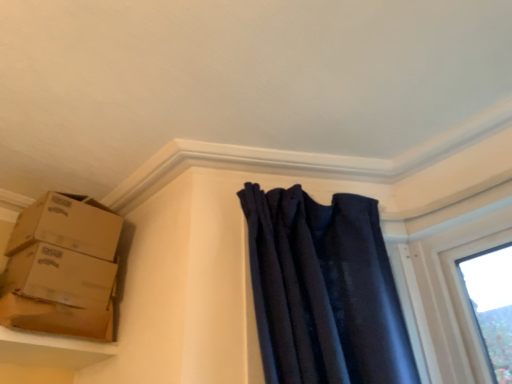
Question: From a real-world perspective, is smooth beige shelf at lower left physically above brown cardboard boxes at left, marked as the 2th box in a top-to-bottom arrangement?

Choices:
 (A) yes
 (B) no

Answer: (B)

Question: Does smooth beige shelf at lower left have a lesser height compared to brown cardboard boxes at left, marked as the 2th box in a top-to-bottom arrangement?

Choices:
 (A) no
 (B) yes

Answer: (B)

Question: Is smooth beige shelf at lower left to the left of brown cardboard boxes at left, the first box when ordered from bottom to top, from the viewer's perspective?

Choices:
 (A) yes
 (B) no

Answer: (A)

Question: Is the position of smooth beige shelf at lower left more distant than that of brown cardboard boxes at left, the first box when ordered from bottom to top?

Choices:
 (A) yes
 (B) no

Answer: (B)

Question: Are smooth beige shelf at lower left and brown cardboard boxes at left, marked as the 2th box in a top-to-bottom arrangement, beside each other?

Choices:
 (A) yes
 (B) no

Answer: (B)

Question: From the image's perspective, is brown cardboard box at left above or below brown cardboard boxes at upper left, the 2th box in the bottom-to-top sequence?

Choices:
 (A) above
 (B) below

Answer: (B)

Question: Considering the positions of brown cardboard box at left and brown cardboard boxes at upper left, the 2th box in the bottom-to-top sequence, in the image, is brown cardboard box at left taller or shorter than brown cardboard boxes at upper left, the 2th box in the bottom-to-top sequence,?

Choices:
 (A) tall
 (B) short

Answer: (B)

Question: Looking at the image, does brown cardboard box at left seem bigger or smaller compared to brown cardboard boxes at upper left, the 2th box in the bottom-to-top sequence?

Choices:
 (A) big
 (B) small

Answer: (B)

Question: Considering the relative positions of brown cardboard box at left and brown cardboard boxes at upper left, the 2th box in the bottom-to-top sequence, in the image provided, is brown cardboard box at left to the left or to the right of brown cardboard boxes at upper left, the 2th box in the bottom-to-top sequence,?

Choices:
 (A) left
 (B) right

Answer: (B)

Question: Considering the positions of brown cardboard boxes at left, marked as the 2th box in a top-to-bottom arrangement, and smooth beige shelf at lower left in the image, is brown cardboard boxes at left, marked as the 2th box in a top-to-bottom arrangement, wider or thinner than smooth beige shelf at lower left?

Choices:
 (A) wide
 (B) thin

Answer: (B)

Question: Relative to smooth beige shelf at lower left, is brown cardboard boxes at left, the first box when ordered from bottom to top, in front or behind?

Choices:
 (A) behind
 (B) front

Answer: (A)

Question: In terms of height, does brown cardboard boxes at left, marked as the 2th box in a top-to-bottom arrangement, look taller or shorter compared to smooth beige shelf at lower left?

Choices:
 (A) short
 (B) tall

Answer: (B)

Question: Is brown cardboard boxes at left, marked as the 2th box in a top-to-bottom arrangement, inside or outside of smooth beige shelf at lower left?

Choices:
 (A) outside
 (B) inside

Answer: (A)

Question: Looking at their shapes, would you say smooth beige shelf at lower left is wider or thinner than brown cardboard boxes at left, the first box when ordered from bottom to top?

Choices:
 (A) wide
 (B) thin

Answer: (A)

Question: Is smooth beige shelf at lower left in front of or behind brown cardboard boxes at left, the first box when ordered from bottom to top, in the image?

Choices:
 (A) front
 (B) behind

Answer: (A)